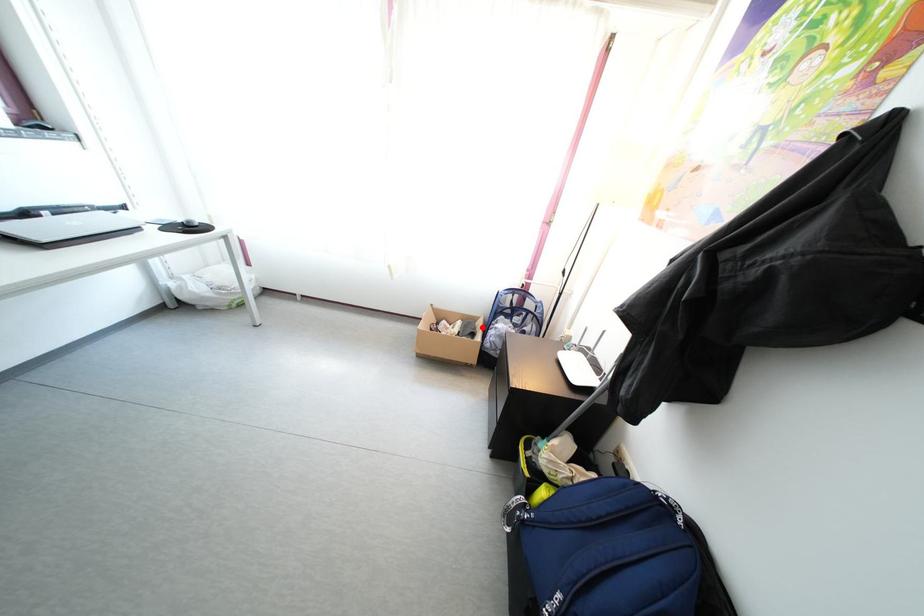
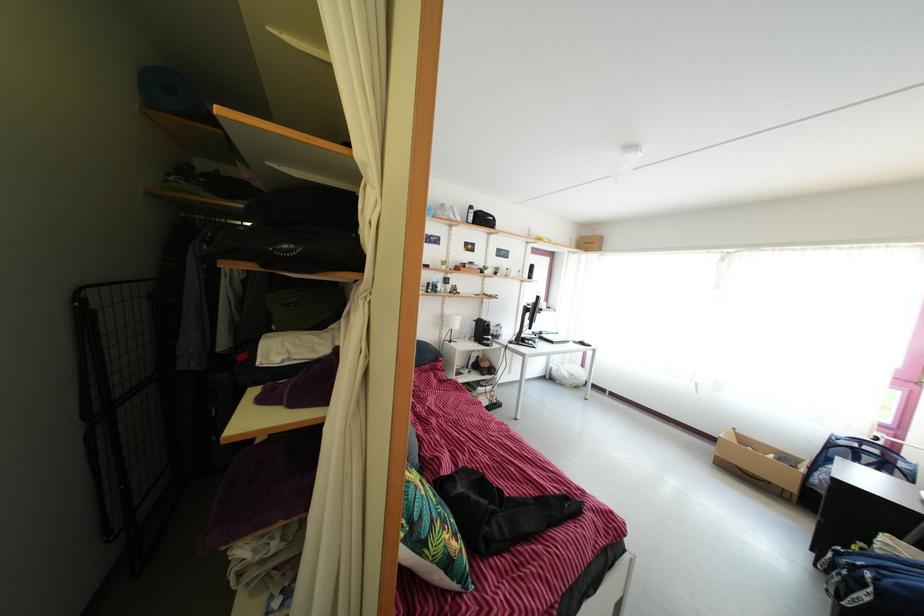
Question: I am providing you with two images of the same scene from different viewpoints. Given a red point in image1, look at the same physical point in image2. Is it:

Choices:
 (A) Closer to the viewpoint
 (B) Farther from the viewpoint

Answer: (B)